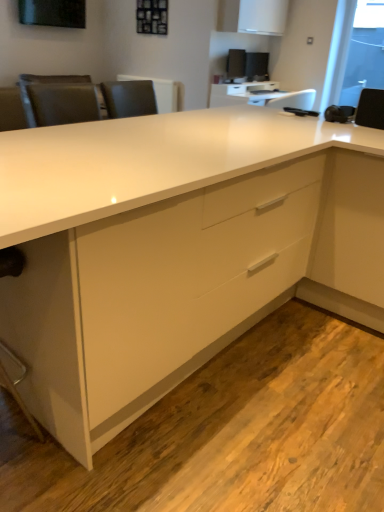
Question: Looking at the image, does white glossy table at upper center seem bigger or smaller compared to satin black monitor at upper center, the 1th computer monitor in the right-to-left sequence?

Choices:
 (A) big
 (B) small

Answer: (A)

Question: Would you say white glossy table at upper center is inside or outside satin black monitor at upper center, the 2th computer monitor positioned from the left?

Choices:
 (A) outside
 (B) inside

Answer: (A)

Question: Estimate the real-world distances between objects in this image. Which object is farther from the white glossy table at upper center?

Choices:
 (A) satin black monitor at upper center, the 1th computer monitor in the right-to-left sequence
 (B) white glossy desk at center
 (C) white matte cabinet at upper center
 (D) transparent glass window screen at upper right
 (E) satin black monitor at upper center, which is counted as the 2th computer monitor, starting from the right

Answer: (B)

Question: Which object is the farthest from the satin black monitor at upper center, the 2th computer monitor positioned from the left?

Choices:
 (A) transparent glass window screen at upper right
 (B) satin black monitor at upper center, positioned as the first computer monitor in left-to-right order
 (C) white glossy table at upper center
 (D) white matte cabinet at upper center
 (E) white glossy desk at center

Answer: (E)